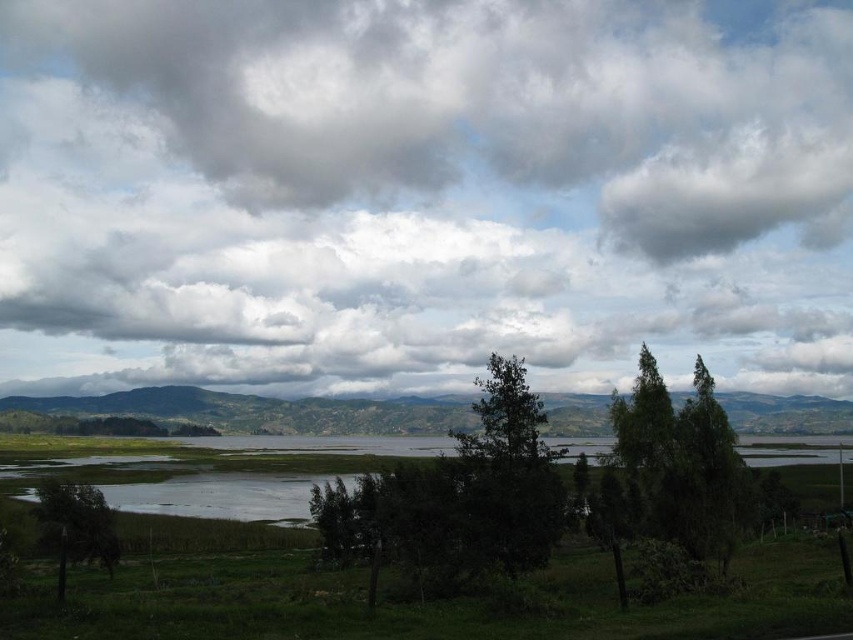
Between clear water at center and green leafy tree at lower left, which one is positioned higher?

Positioned higher is green leafy tree at lower left.

Does point (228, 492) lie behind point (96, 513)?

Yes, point (228, 492) is farther from viewer.

Between point (395, 440) and point (67, 529), which one is positioned in front?

Point (67, 529) is more forward.

Where is `clear water at center`? Image resolution: width=853 pixels, height=640 pixels. clear water at center is located at coordinates (224, 493).

Does cloudy sky at upper center appear over green leafy tree at right?

Correct, cloudy sky at upper center is located above green leafy tree at right.

Is point (717, 173) closer to viewer compared to point (718, 540)?

No, (717, 173) is further to viewer.

I want to click on cloudy sky at upper center, so (422, 193).

Can you confirm if green leafy tree at right is positioned below green leafy tree at lower left?

Actually, green leafy tree at right is above green leafy tree at lower left.

Which is more to the right, green leafy tree at right or green leafy tree at lower left?

green leafy tree at right is more to the right.

Describe the element at coordinates (708, 476) in the screenshot. This screenshot has height=640, width=853. I see `green leafy tree at right` at that location.

Locate an element on the screen. This screenshot has height=640, width=853. green leafy tree at right is located at coordinates (x=708, y=476).